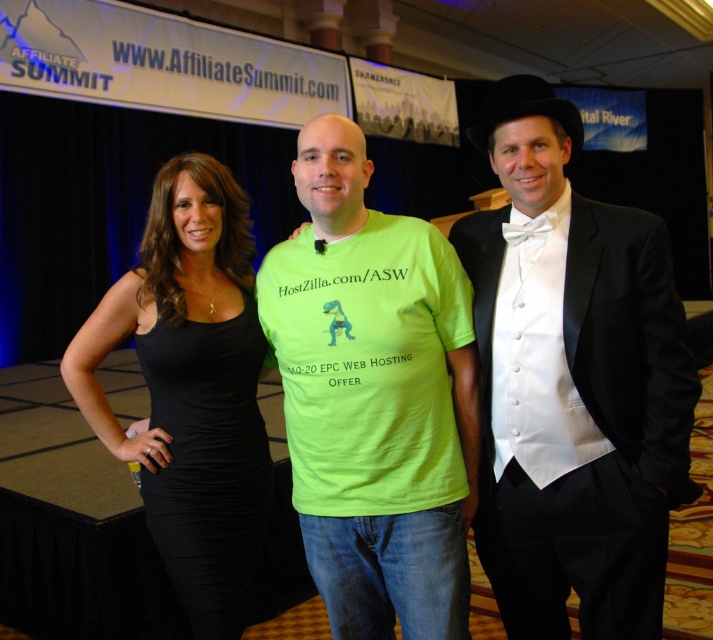
Which is below, black satin suit at right or neon green t-shirt at center?

Positioned lower is neon green t-shirt at center.

Is black satin suit at right thinner than neon green t-shirt at center?

Yes.

Find the location of a particular element. This screenshot has width=713, height=640. black satin suit at right is located at coordinates (573, 384).

Is black satin suit at right to the right of white satin vest at center from the viewer's perspective?

Correct, you'll find black satin suit at right to the right of white satin vest at center.

Is point (630, 513) more distant than point (512, 275)?

No, it is not.

Does point (588, 577) come farther from viewer compared to point (533, 451)?

Yes, point (588, 577) is behind point (533, 451).

At what (x,y) coordinates should I click in order to perform the action: click on black satin suit at right. Please return your answer as a coordinate pair (x, y). The height and width of the screenshot is (640, 713). Looking at the image, I should click on (573, 384).

Does black dress at left appear over black satin dress at left?

Yes, black dress at left is above black satin dress at left.

Is black dress at left below black satin dress at left?

Actually, black dress at left is above black satin dress at left.

This screenshot has height=640, width=713. I want to click on black dress at left, so click(190, 388).